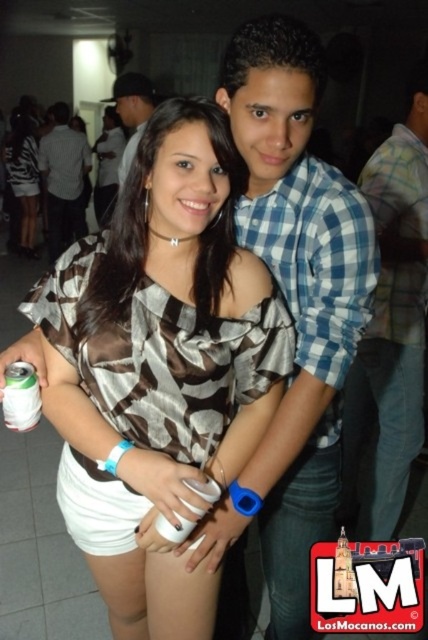
You are organizing a charity event and need to display two dresses, the brown satin blouse at center and the matte black dress at center, on a mannequin. Since the display area is limited, you want to know which dress takes up more space so you can arrange them accordingly. Which one requires more space?

The matte black dress at center requires more space because the brown satin blouse at center occupies less space than it.

You are standing at the position of the person on the left and want to throw a ball to the person on the right. Which of the two points, point (291, 68) or point (125, 77), should you aim for to ensure it reaches the person on the right without going behind the other point?

You should aim for point (125, 77) because point (291, 68) is in front of it, so throwing to point (125, 77) would avoid going behind point (291, 68).

You are a photographer at a party and need to capture both the blue plaid shirt at center and the matte black dress at center in a single frame. Which object should you focus on to ensure both are visible without cropping?

You should focus on the blue plaid shirt at center because it occupies less space than the matte black dress at center, allowing both to fit within the frame.